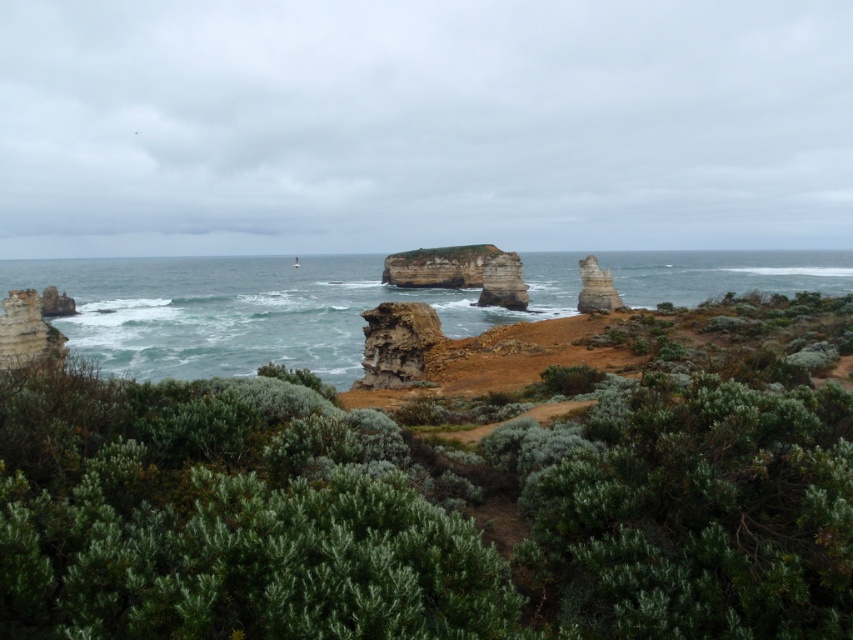
Question: Which point is farther to the camera?

Choices:
 (A) rusty stone rock at center
 (B) rusty stone cliff at left

Answer: (B)

Question: Does greenish-blue water at center have a larger size compared to smooth gray rock at upper right?

Choices:
 (A) yes
 (B) no

Answer: (A)

Question: Which of the following is the closest to the observer?

Choices:
 (A) (352, 589)
 (B) (397, 342)

Answer: (A)

Question: Based on their relative distances, which object is nearer to the greenish-blue water at center?

Choices:
 (A) smooth gray rock at upper right
 (B) rusty stone arch at center
 (C) green shrubbery at center

Answer: (B)

Question: Does green shrubbery at center have a lesser width compared to smooth gray rock at upper right?

Choices:
 (A) yes
 (B) no

Answer: (B)

Question: Considering the relative positions of rusty stone cliff at left and smooth gray rock at upper right in the image provided, where is rusty stone cliff at left located with respect to smooth gray rock at upper right?

Choices:
 (A) left
 (B) right

Answer: (A)